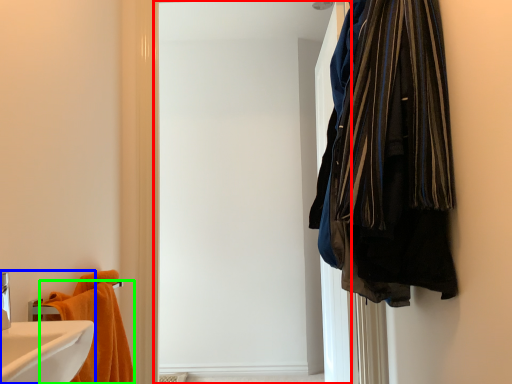
Question: Which is nearer to the screen door (highlighted by a red box)? bathroom cabinet (highlighted by a blue box) or towel (highlighted by a green box).

Choices:
 (A) bathroom cabinet
 (B) towel

Answer: (B)